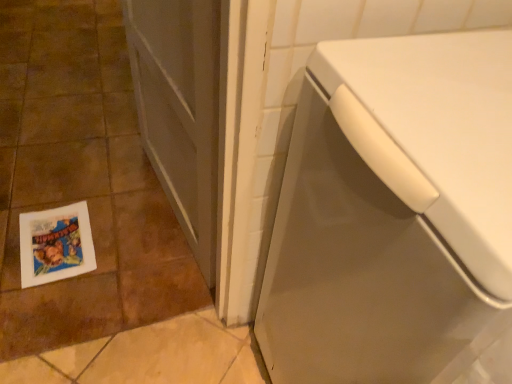
Question: Is white glossy tile at lower left to the left or to the right of matte gray screen door at center in the image?

Choices:
 (A) left
 (B) right

Answer: (A)

Question: Considering the positions of white glossy tile at lower left and matte gray screen door at center in the image, is white glossy tile at lower left wider or thinner than matte gray screen door at center?

Choices:
 (A) wide
 (B) thin

Answer: (A)

Question: Estimate the real-world distances between objects in this image. Which object is farther from the white glossy washing machine at lower right?

Choices:
 (A) matte gray screen door at center
 (B) white paper flyer at lower left
 (C) white glossy tile at lower left

Answer: (B)

Question: Which object is the farthest from the white paper flyer at lower left?

Choices:
 (A) white glossy tile at lower left
 (B) matte gray screen door at center
 (C) white glossy washing machine at lower right

Answer: (C)